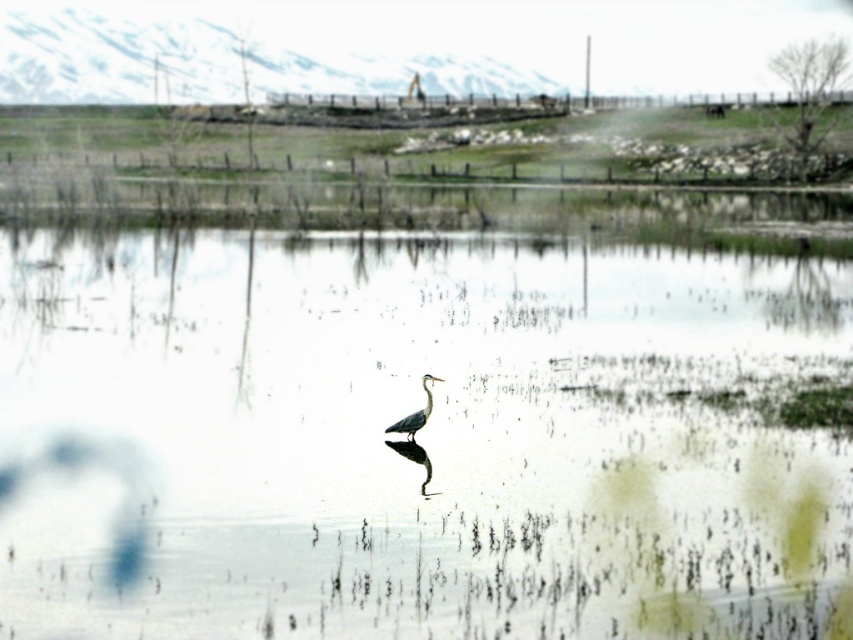
You are an ornithologist observing the scene. You notice the clear water at center and the gray matte bird at center. Which object is closer to the observer?

The clear water at center is positioned over the gray matte bird at center, meaning the clear water at center is closer to the observer.

You are an environmental scientist observing the scene. You need to determine if the gray matte bird at center can fit entirely within the clear water at center without any part of it extending beyond the water. Based on their sizes, what is your conclusion?

The clear water at center has a larger width than the gray matte bird at center. Therefore, the gray matte bird at center can fit entirely within the clear water at center without any part extending beyond it.